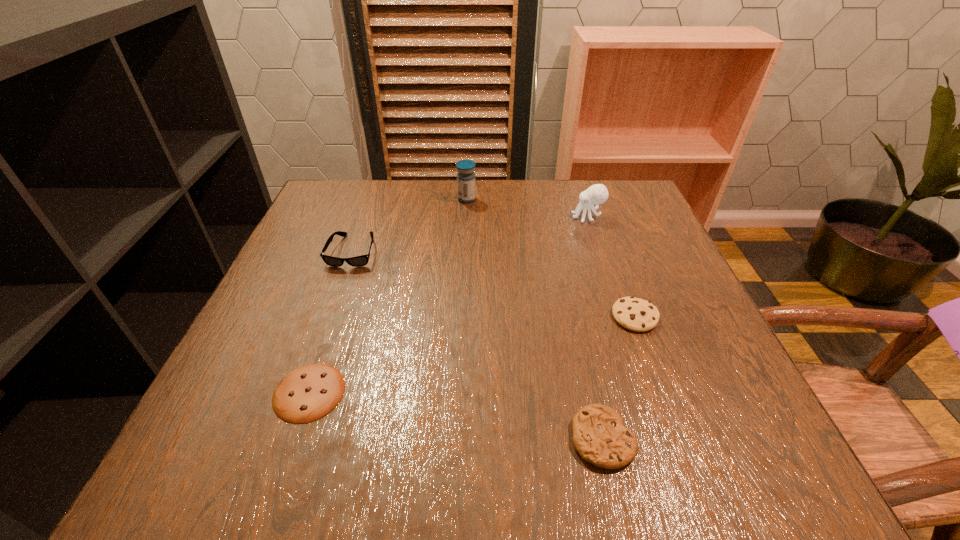
Where is `vacant space that satisfies the following two spatial constraints: 1. on the front side of the third object from left to right; 2. on the left side of the farthest cookie`? This screenshot has height=540, width=960. vacant space that satisfies the following two spatial constraints: 1. on the front side of the third object from left to right; 2. on the left side of the farthest cookie is located at coordinates (462, 316).

Identify the location of vacant region that satisfies the following two spatial constraints: 1. on the front-facing side of the sunglasses; 2. on the left side of the leftmost cookie. This screenshot has width=960, height=540. (303, 392).

Identify the location of free point that satisfies the following two spatial constraints: 1. on the front-facing side of the shortest object; 2. on the right side of the third farthest object. (303, 392).